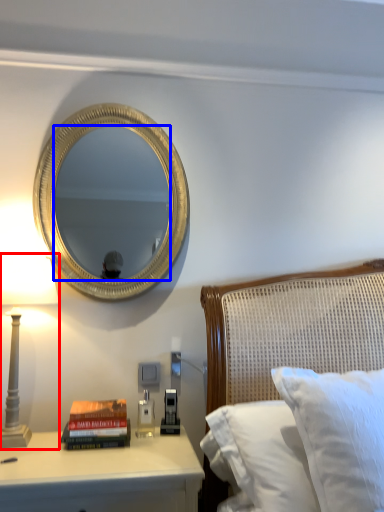
Question: Which object appears closest to the camera in this image, bedside lamp (highlighted by a red box) or mirror (highlighted by a blue box)?

Choices:
 (A) bedside lamp
 (B) mirror

Answer: (A)